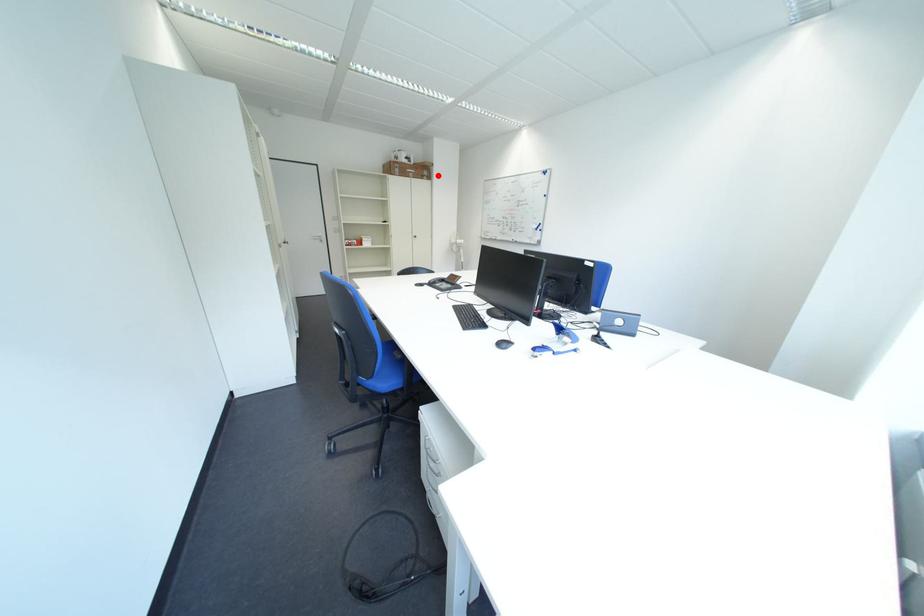
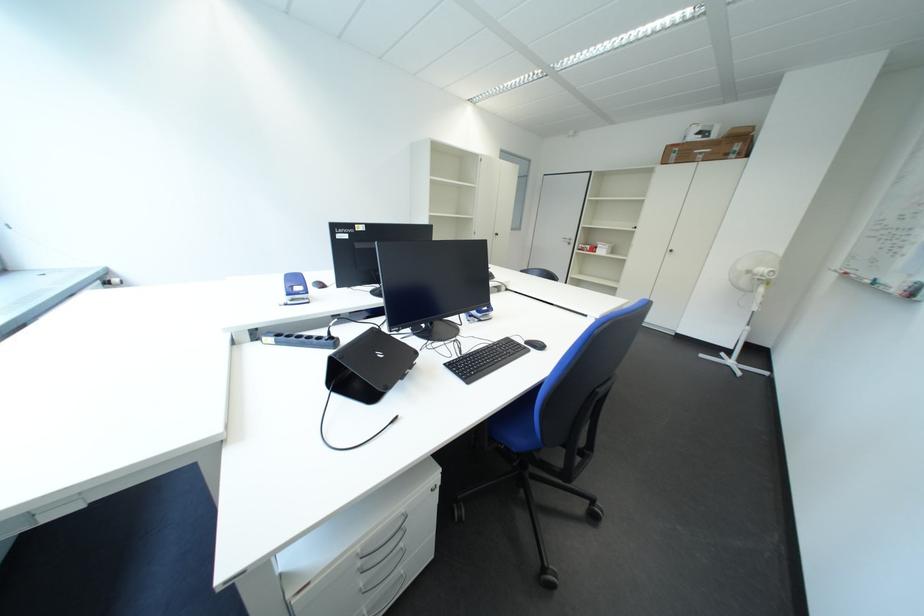
Question: I am providing you with two images of the same scene from different viewpoints. Given a red point in image1, look at the same physical point in image2. Is it:

Choices:
 (A) Closer to the viewpoint
 (B) Farther from the viewpoint

Answer: (B)